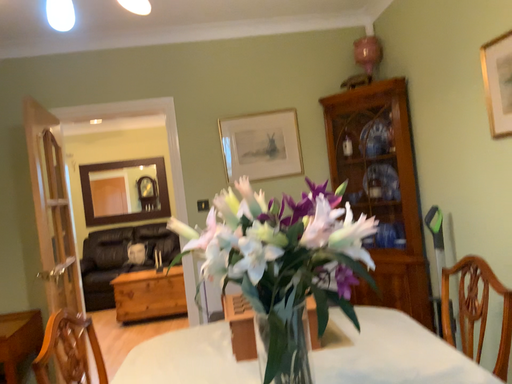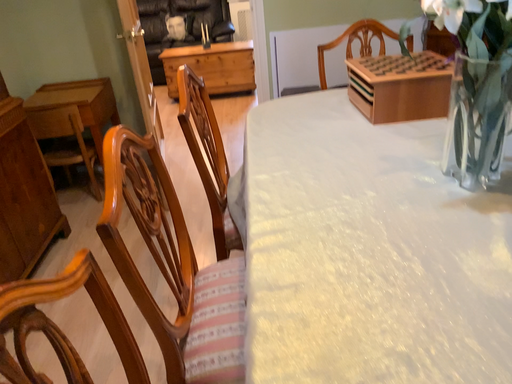
Question: Which way did the camera rotate in the video?

Choices:
 (A) rotated upward
 (B) rotated downward

Answer: (B)